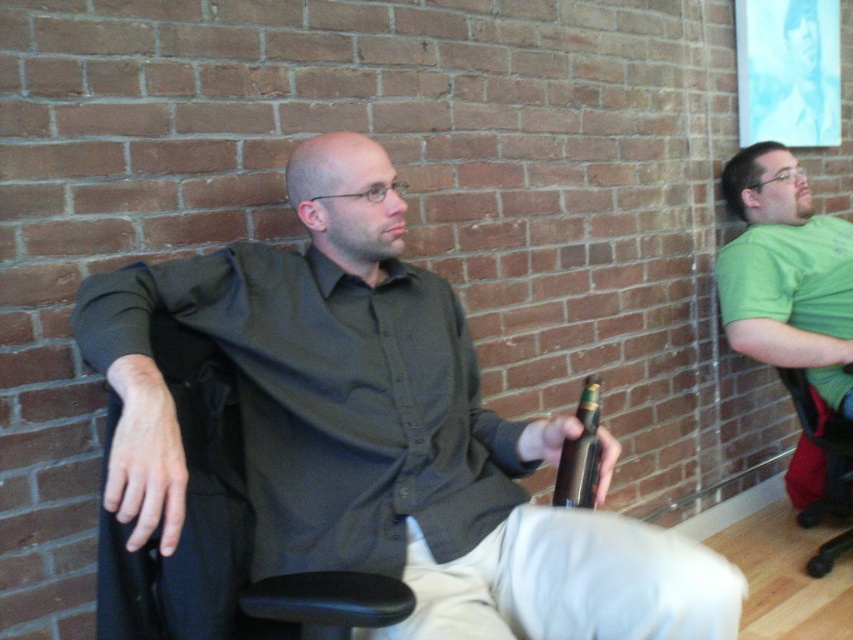
Question: Is matte black shirt at center positioned in front of green matte shirt at right?

Choices:
 (A) no
 (B) yes

Answer: (B)

Question: Among these points, which one is farthest from the camera?

Choices:
 (A) (827, 422)
 (B) (190, 336)
 (C) (450, 294)
 (D) (427, 481)

Answer: (A)

Question: Which is farther from the green matte shirt at right?

Choices:
 (A) brown metallic bottle at center
 (B) black leather swivel chair at left
 (C) khaki pants at lower center

Answer: (B)

Question: Can you confirm if matte black shirt at center is positioned above khaki pants at lower center?

Choices:
 (A) no
 (B) yes

Answer: (B)

Question: Is black leather swivel chair at left positioned at the back of green matte shirt at right?

Choices:
 (A) yes
 (B) no

Answer: (B)

Question: Which object is positioned closest to the black leather swivel chair at left?

Choices:
 (A) brown metallic bottle at center
 (B) matte black shirt at center
 (C) green matte shirt at right

Answer: (B)